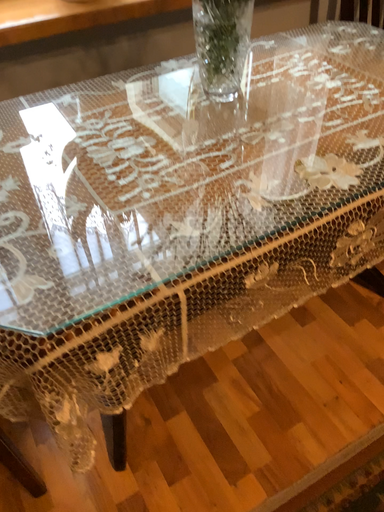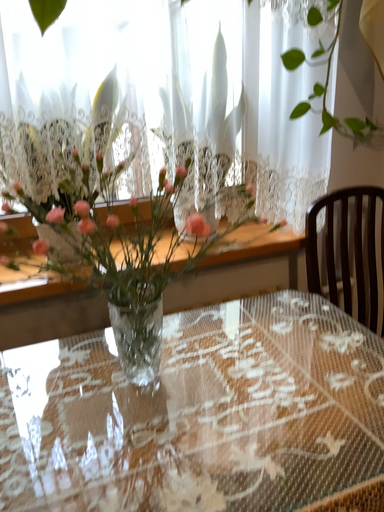
Question: Which way did the camera rotate in the video?

Choices:
 (A) rotated upward
 (B) rotated downward

Answer: (A)